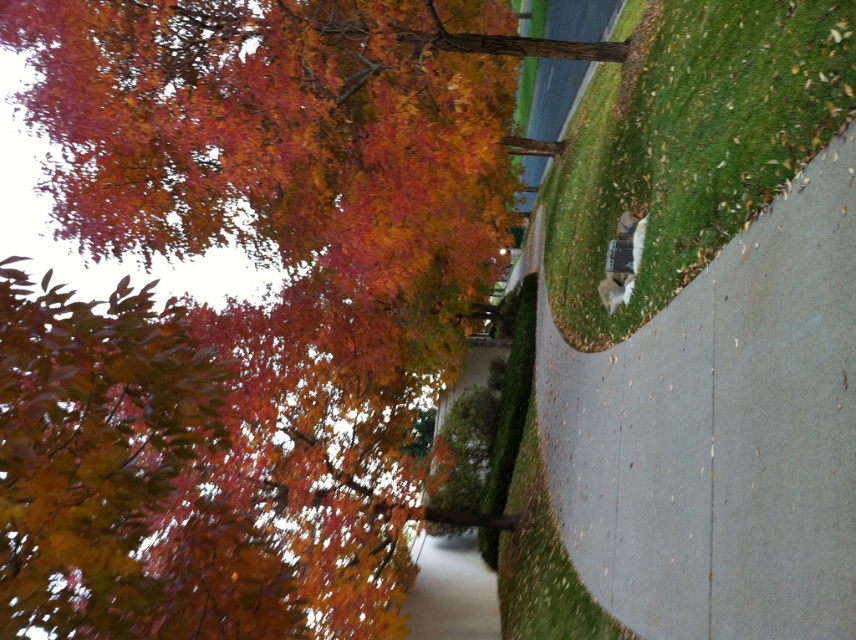
You are standing at the point marked as point (288, 116) in the autumn scene. If you want to walk straight towards the building in the background, will you have to navigate around any obstacles along the path?

The distance between point (288, 116) and the viewer is 26.49 feet. Since the path is a clean sidewalk curving through the grassy area with scattered leaves, there are no significant obstacles blocking the straight path towards the building. However, you may need to step over or around the scattered leaves for safety.

You are a gardener planning to clear the autumn leaves at upper left and the green grass at lower right. Which area requires more effort to maintain based on their height?

The autumn leaves at upper left require more effort to maintain because they are much taller than the green grass at lower right.

You are a gardener planning to clear the autumn leaves at upper left and the green grass at lower right. Which area requires more effort to clear based on their sizes?

The autumn leaves at upper left requires more effort to clear because it is larger in size than the green grass at lower right.